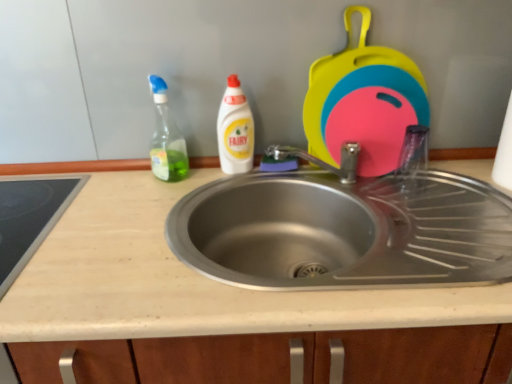
The width and height of the screenshot is (512, 384). Find the location of `vacant area to the left of white glossy bottle at center, the 2th cleaning product in the left-to-right sequence`. vacant area to the left of white glossy bottle at center, the 2th cleaning product in the left-to-right sequence is located at coordinates (177, 184).